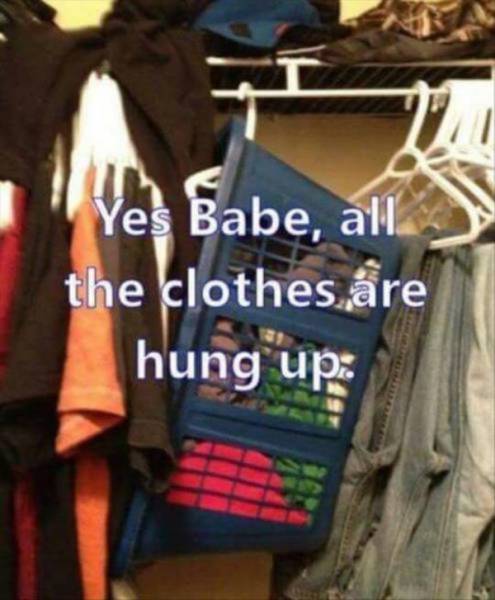
Identify the location of hangers on right. Image resolution: width=495 pixels, height=600 pixels. (455, 136).